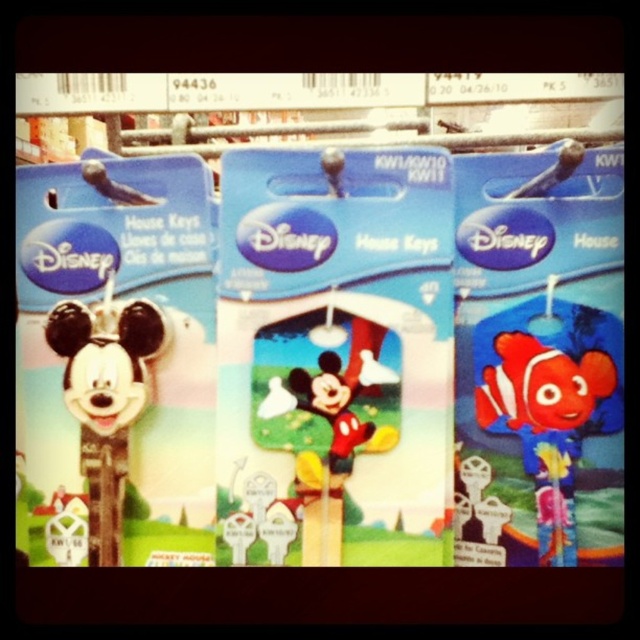
Question: Which point is closer to the camera?

Choices:
 (A) (128, 451)
 (B) (125, 193)
 (C) (556, 554)

Answer: (C)

Question: From the image, what is the correct spatial relationship of matte plastic mickey mouse keychain at left in relation to matte black mickey mouse keychain at left?

Choices:
 (A) above
 (B) below

Answer: (B)

Question: Which is farther from the red rubber clownfish at center?

Choices:
 (A) matte plastic mickey mouse keychain at left
 (B) matte black mickey mouse keychain at left

Answer: (B)

Question: Can you confirm if red rubber clownfish at center is positioned above matte plastic mickey mouse keychain at left?

Choices:
 (A) yes
 (B) no

Answer: (B)

Question: Does matte plastic mickey mouse keychain at left appear under matte black mickey mouse keychain at left?

Choices:
 (A) yes
 (B) no

Answer: (A)

Question: Which object is positioned farthest from the matte black mickey mouse keychain at left?

Choices:
 (A) red rubber clownfish at center
 (B) matte plastic mickey mouse keychain at left

Answer: (A)